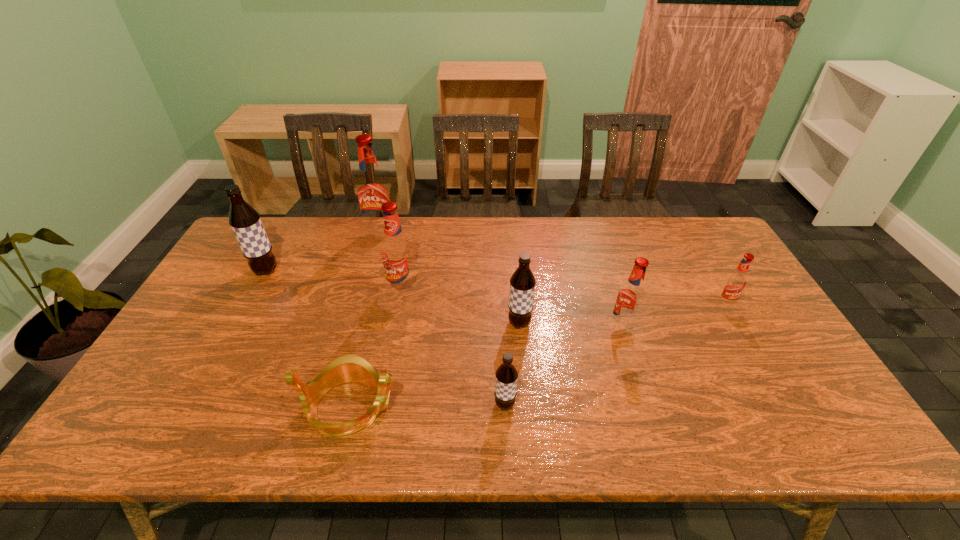
Identify which object is located as the sixth nearest to the fifth root beer from right to left. Please provide its 2D coordinates. Your answer should be formatted as a tuple, i.e. [(x, y)], where the tuple contains the x and y coordinates of a point satisfying the conditions above.

[(630, 299)]

Locate an element on the screen. Image resolution: width=960 pixels, height=540 pixels. the seventh closest object relative to the second biggest red root beer is located at coordinates (735, 283).

Where is `root beer that stands as the fifth closest to the leftmost object`? The width and height of the screenshot is (960, 540). root beer that stands as the fifth closest to the leftmost object is located at coordinates (630, 299).

Locate an element on the screen. the fifth closest root beer to the smallest red root beer is located at coordinates (372, 189).

Where is `red root beer that can be found as the fourth closest to the gold tiara`? The width and height of the screenshot is (960, 540). red root beer that can be found as the fourth closest to the gold tiara is located at coordinates (735, 283).

Identify which red root beer is the closest to the shortest object. Please provide its 2D coordinates. Your answer should be formatted as a tuple, i.e. [(x, y)], where the tuple contains the x and y coordinates of a point satisfying the conditions above.

[(396, 252)]

Identify which brown root beer is located as the second nearest to the tiara. Please provide its 2D coordinates. Your answer should be formatted as a tuple, i.e. [(x, y)], where the tuple contains the x and y coordinates of a point satisfying the conditions above.

[(522, 282)]

Locate which brown root beer is the third closest to the sixth root beer from left to right. Please provide its 2D coordinates. Your answer should be formatted as a tuple, i.e. [(x, y)], where the tuple contains the x and y coordinates of a point satisfying the conditions above.

[(245, 221)]